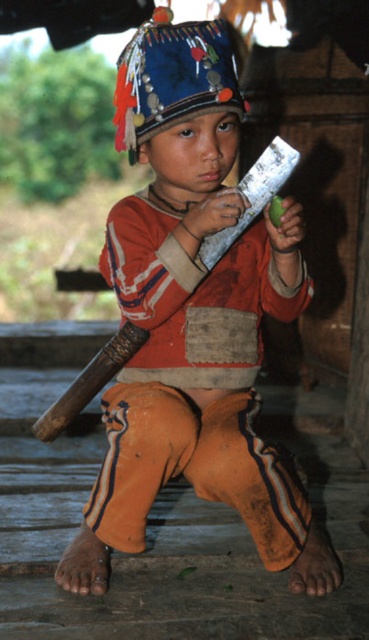
Question: Which point is closer to the camera?

Choices:
 (A) (73, 410)
 (B) (318, 582)
 (C) (245, 173)

Answer: (B)

Question: Observing the image, what is the correct spatial positioning of brown wood baseball bat at lower left in reference to silver metallic baseball bat at center?

Choices:
 (A) left
 (B) right

Answer: (A)

Question: Which object is positioned farthest from the orange cotton pants at lower center?

Choices:
 (A) silver metallic baseball bat at center
 (B) brown wood baseball bat at lower left

Answer: (B)

Question: Which of these objects is positioned farthest from the brown wood baseball bat at lower left?

Choices:
 (A) silver metallic baseball bat at center
 (B) orange cotton pants at lower center

Answer: (A)

Question: Does orange cotton pants at lower center appear on the left side of silver metallic baseball bat at center?

Choices:
 (A) yes
 (B) no

Answer: (A)

Question: Does orange cotton pants at lower center appear on the right side of brown wood baseball bat at lower left?

Choices:
 (A) no
 (B) yes

Answer: (B)